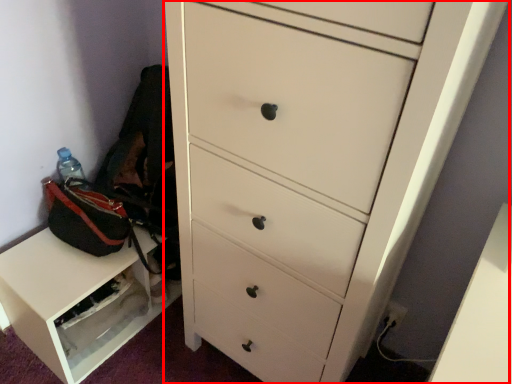
Question: Where is chest of drawers (annotated by the red box) located in relation to cabinetry in the image?

Choices:
 (A) left
 (B) right

Answer: (B)